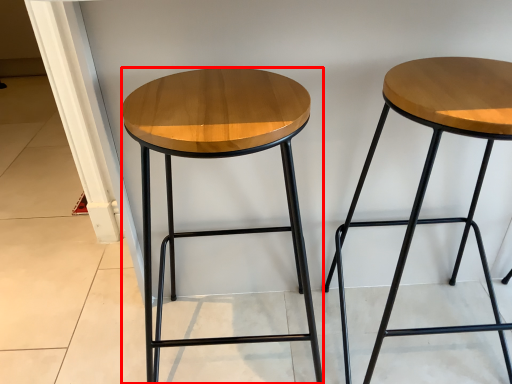
Question: From the image's perspective, where is stool (annotated by the red box) located relative to stool?

Choices:
 (A) below
 (B) above

Answer: (A)